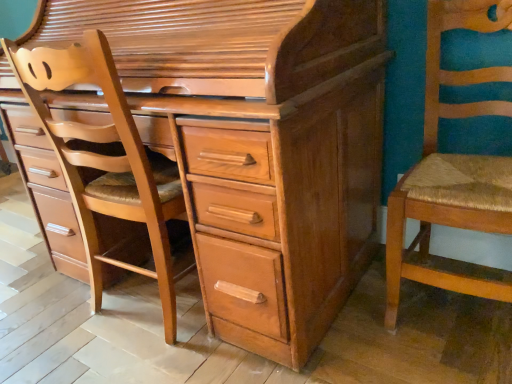
Question: Does point (49, 230) appear closer or farther from the camera than point (439, 175)?

Choices:
 (A) closer
 (B) farther

Answer: (B)

Question: Is light brown wood chest of drawers at center to the left or to the right of wooden woven seat at right in the image?

Choices:
 (A) left
 (B) right

Answer: (A)

Question: Estimate the real-world distances between objects in this image. Which object is closer to the light brown wood chair at left?

Choices:
 (A) wooden woven seat at right
 (B) light brown wood chest of drawers at center

Answer: (B)

Question: Estimate the real-world distances between objects in this image. Which object is closer to the light brown wood chair at left?

Choices:
 (A) wooden woven seat at right
 (B) light brown wood chest of drawers at center

Answer: (B)